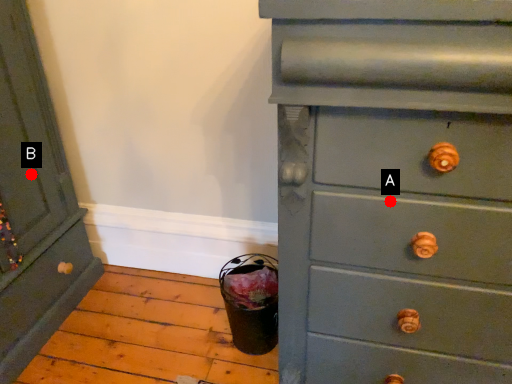
Question: Two points are circled on the image, labeled by A and B beside each circle. Among these points, which one is farthest from the camera?

Choices:
 (A) A is further
 (B) B is further

Answer: (B)